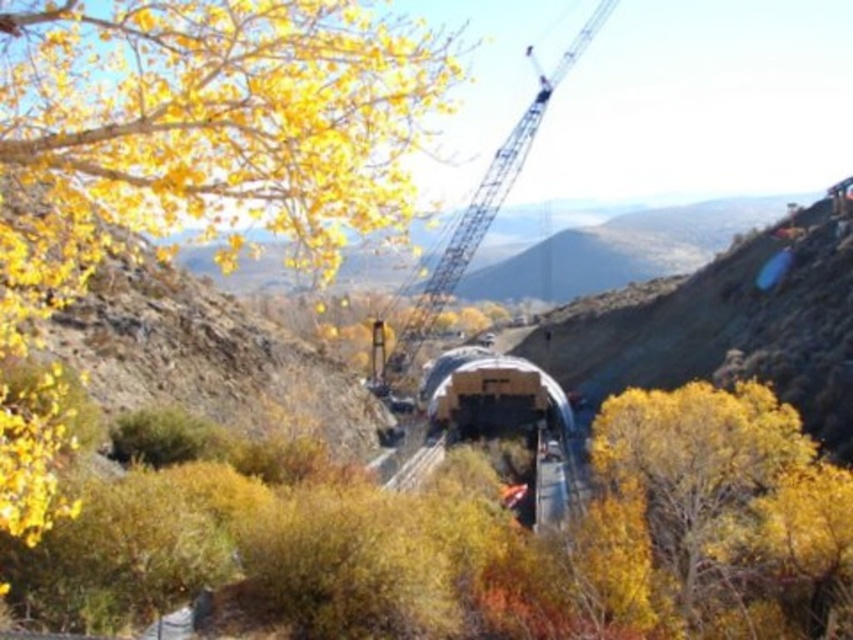
Does yellow matte tree at center appear over metallic silver train at center?

Yes, yellow matte tree at center is above metallic silver train at center.

Between point (668, 516) and point (541, 406), which one is positioned behind?

The point (541, 406) is behind.

Image resolution: width=853 pixels, height=640 pixels. I want to click on yellow matte tree at center, so 694,458.

Between yellow leafy tree at upper left and yellow matte tree at center, which one appears on the right side from the viewer's perspective?

yellow matte tree at center

Between yellow leafy tree at upper left and yellow matte tree at center, which one is positioned lower?

yellow matte tree at center is below.

This screenshot has height=640, width=853. Identify the location of yellow leafy tree at upper left. (184, 156).

Can you confirm if yellow matte tree at center is thinner than metallic gray crane at upper center?

Correct, yellow matte tree at center's width is less than metallic gray crane at upper center's.

Who is taller, yellow matte tree at center or metallic gray crane at upper center?

metallic gray crane at upper center

Locate an element on the screen. yellow matte tree at center is located at coordinates (694, 458).

Where is `yellow matte tree at center`? The image size is (853, 640). yellow matte tree at center is located at coordinates (694, 458).